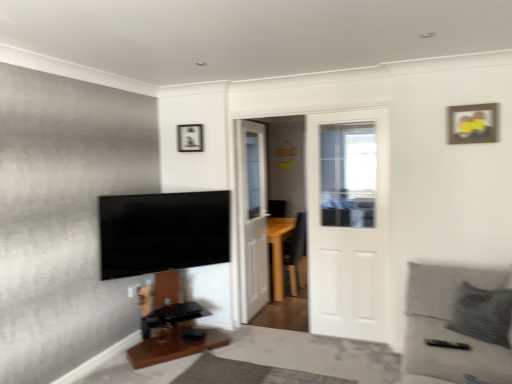
Question: In terms of width, does white wooden door at center, placed as the 1th door when sorted from left to right, look wider or thinner when compared to wooden picture frame at upper center, which is counted as the 1th picture frame, starting from the left?

Choices:
 (A) thin
 (B) wide

Answer: (B)

Question: Considering the positions of point (262, 145) and point (183, 137), is point (262, 145) closer or farther from the camera than point (183, 137)?

Choices:
 (A) closer
 (B) farther

Answer: (B)

Question: Which of these objects is positioned farthest from the gray fabric couch at lower right?

Choices:
 (A) white wooden door at center, acting as the 2th door starting from the front
 (B) wooden picture frame at upper center, which is counted as the 1th picture frame, starting from the left
 (C) white wooden door at center, the 1th door when ordered from right to left
 (D) wooden picture frame at upper right, positioned as the second picture frame in left-to-right order
 (E) wooden table at lower center

Answer: (B)

Question: Estimate the real-world distances between objects in this image. Which object is closer to the gray fabric couch at lower right?

Choices:
 (A) wooden picture frame at upper center, the first picture frame from the back
 (B) white wooden door at center, placed as the 1th door when sorted from left to right
 (C) wooden table at lower center
 (D) flat screen tv at left
 (E) white wooden door at center, the 2th door when ordered from back to front

Answer: (E)